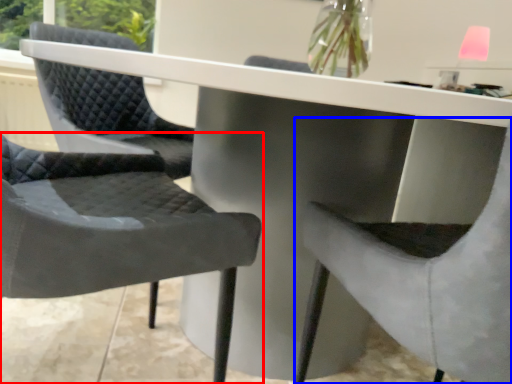
Question: Which of the following is the closest to the observer, chair (highlighted by a red box) or chair (highlighted by a blue box)?

Choices:
 (A) chair
 (B) chair

Answer: (B)